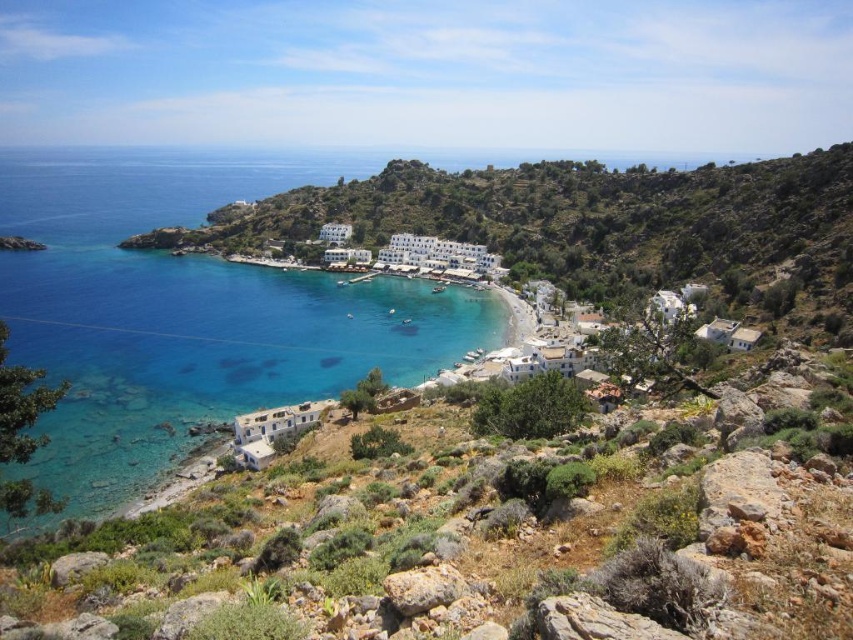
Question: Can you confirm if clear blue water at center is positioned below white stone buildings at center?

Choices:
 (A) no
 (B) yes

Answer: (A)

Question: Is clear blue water at center positioned at the back of white stone buildings at center?

Choices:
 (A) yes
 (B) no

Answer: (B)

Question: Which point is farther from the camera taking this photo?

Choices:
 (A) (140, 307)
 (B) (555, 212)

Answer: (B)

Question: Which point appears closest to the camera in this image?

Choices:
 (A) (73, 362)
 (B) (788, 180)

Answer: (A)

Question: Where is clear blue water at center located in relation to white stone buildings at center in the image?

Choices:
 (A) left
 (B) right

Answer: (A)